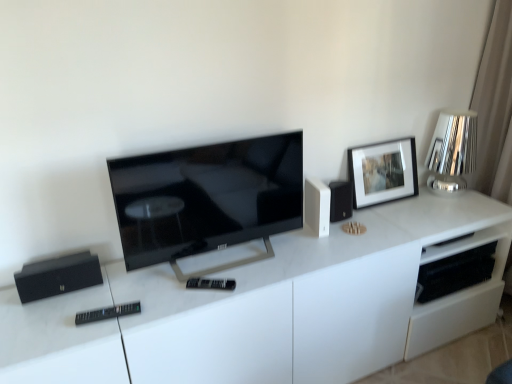
Identify the location of free space between black plastic remote at center, the second remote positioned from the front, and white matte speaker at upper right. Image resolution: width=512 pixels, height=384 pixels. (273, 261).